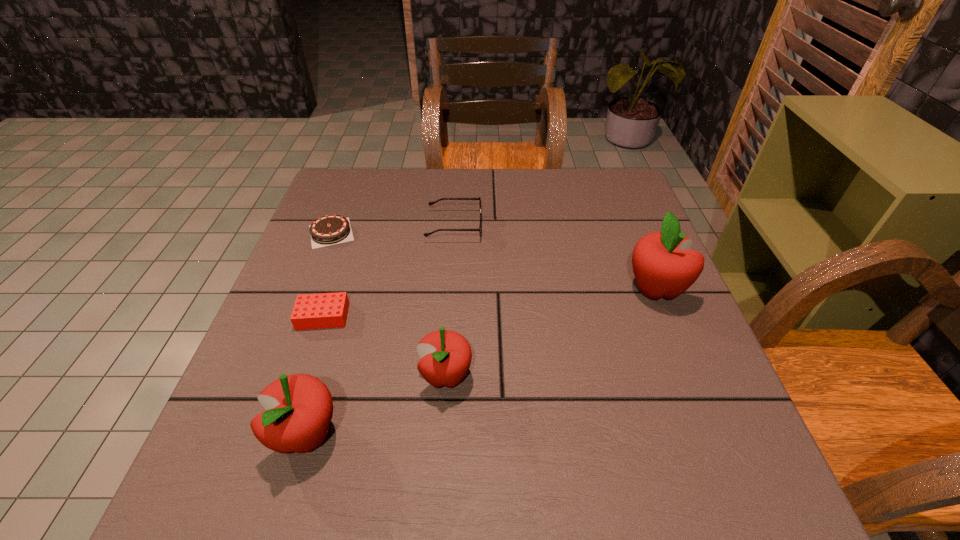
To achieve uniform spacing by inserting another apple among them, please point to a free space for this new apple. Please provide its 2D coordinates. Your answer should be formatted as a tuple, i.e. [(x, y)], where the tuple contains the x and y coordinates of a point satisfying the conditions above.

[(560, 329)]